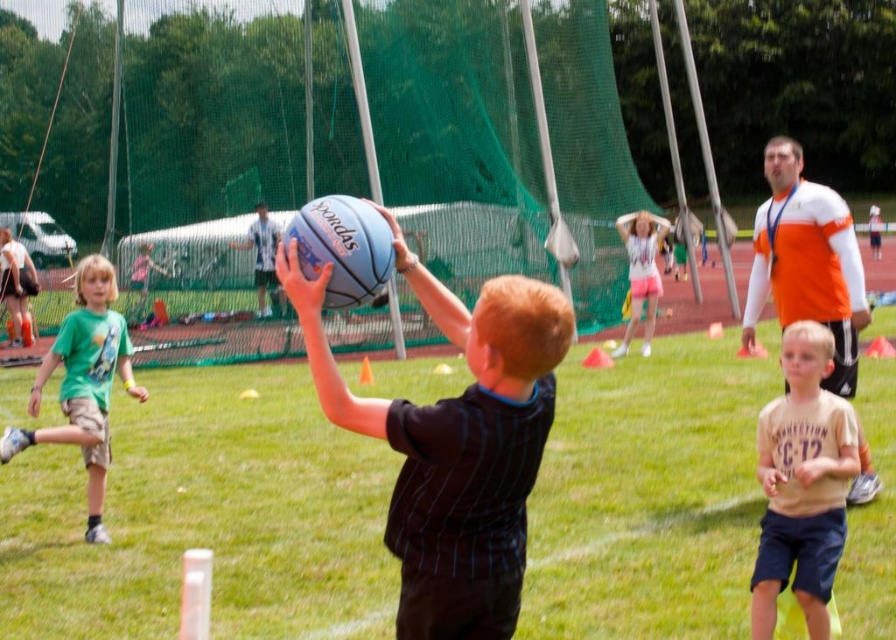
Who is positioned more to the right, blue rubber ball at center or green cotton shirt at left?

blue rubber ball at center is more to the right.

Does blue rubber ball at center appear over green cotton shirt at left?

Incorrect, blue rubber ball at center is not positioned above green cotton shirt at left.

Which is in front, point (657, 602) or point (109, 268)?

Point (657, 602)

Where is `blue rubber ball at center`? blue rubber ball at center is located at coordinates (205, 516).

Who is more forward, (328, 632) or (795, 308)?

Positioned in front is point (328, 632).

At what (x,y) coordinates should I click in order to perform the action: click on blue rubber ball at center. Please return your answer as a coordinate pair (x, y). Image resolution: width=896 pixels, height=640 pixels. Looking at the image, I should click on (205, 516).

Locate an element on the screen. This screenshot has height=640, width=896. blue rubber ball at center is located at coordinates (205, 516).

Looking at this image, does blue rubber ball at center have a smaller size compared to light brown cotton shirt at lower right?

No, blue rubber ball at center is not smaller than light brown cotton shirt at lower right.

Is blue rubber ball at center taller than light brown cotton shirt at lower right?

Indeed, blue rubber ball at center has a greater height compared to light brown cotton shirt at lower right.

You are a GUI agent. You are given a task and a screenshot of the screen. Output one action in this format:
    pyautogui.click(x=<x>, y=<y>)
    Task: Click on the blue rubber ball at center
    This screenshot has height=640, width=896.
    Given the screenshot: What is the action you would take?
    pyautogui.click(x=205, y=516)

Identify the location of blue rubber ball at center. (205, 516).